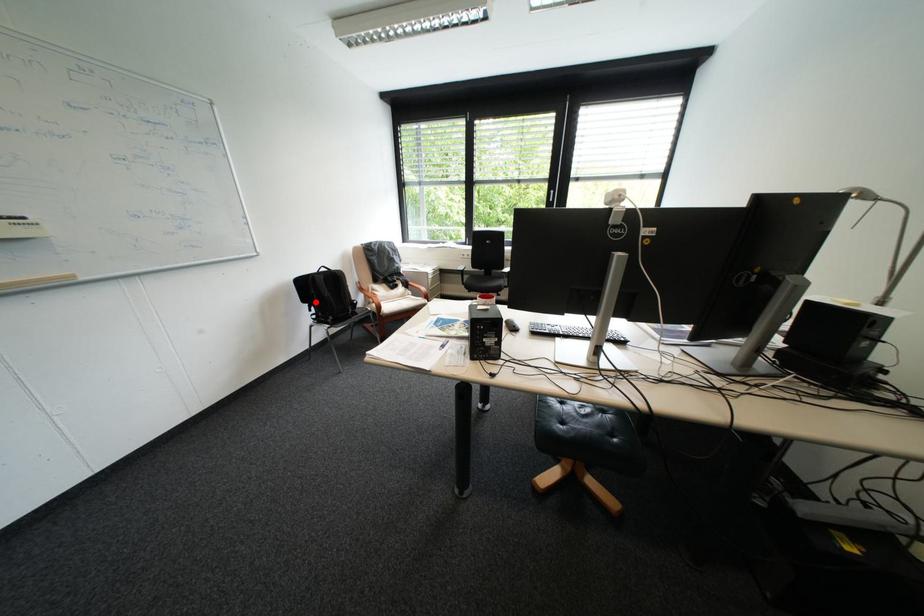
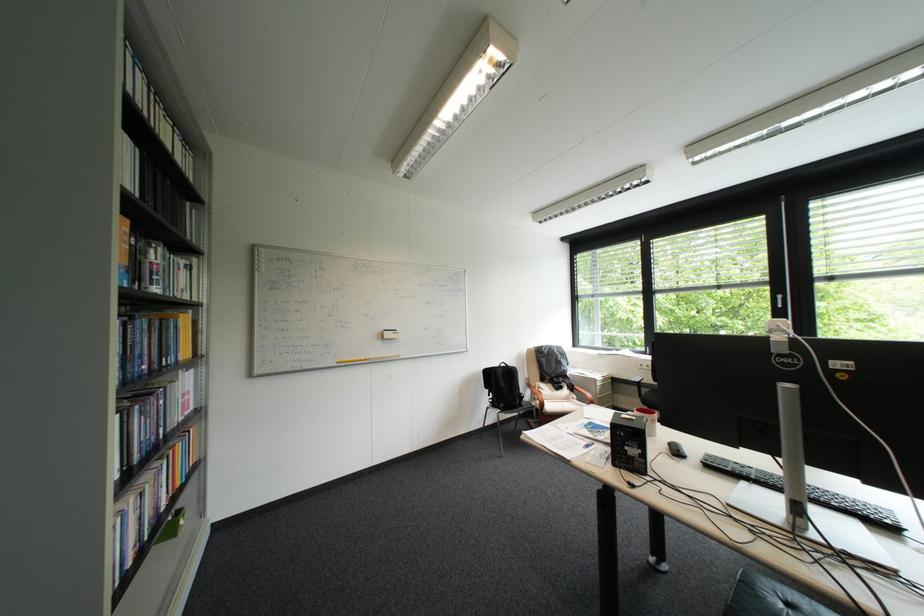
The point at the highlighted location is marked in the first image. Where is the corresponding point in the second image?

(497, 387)